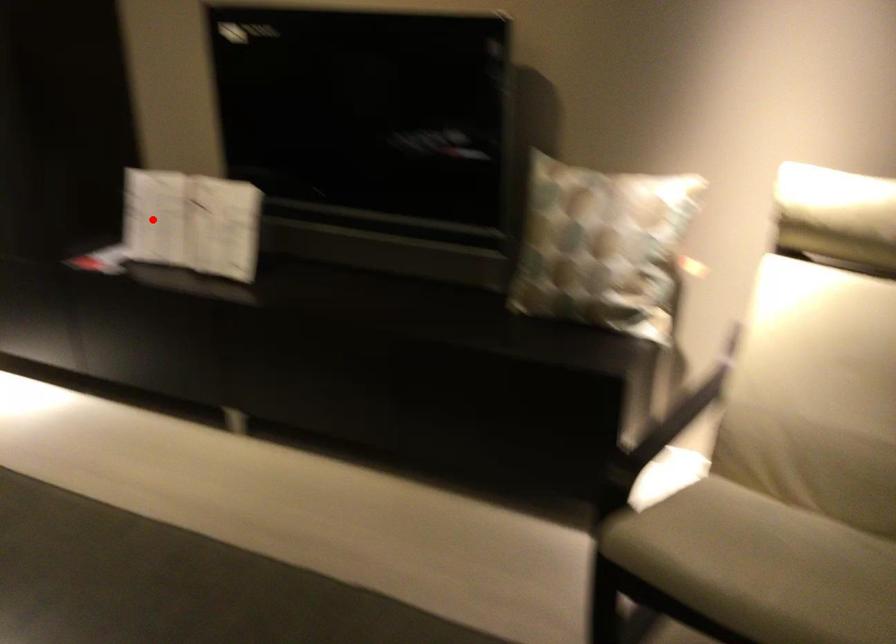
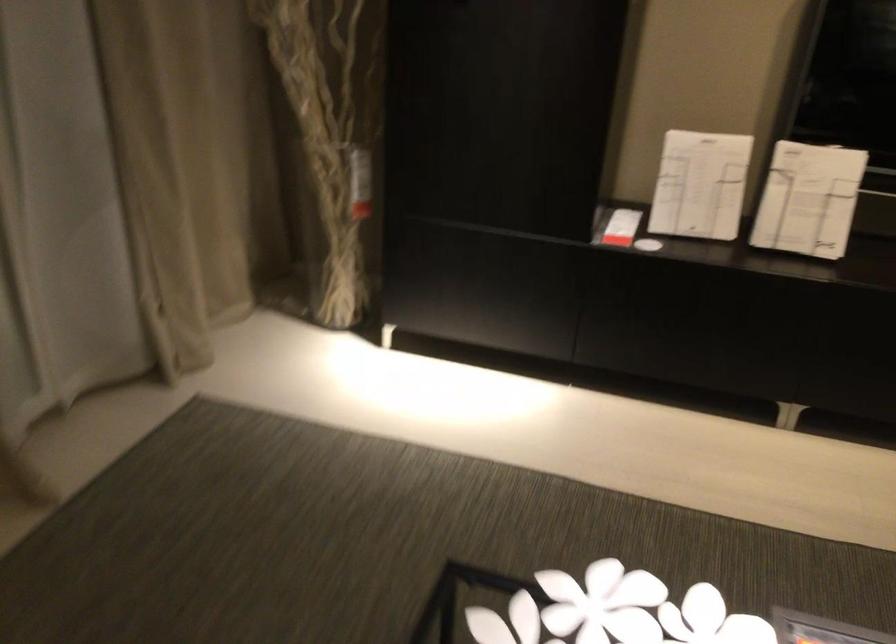
Question: I am providing you with two images of the same scene from different viewpoints. In image1, a red point is highlighted. Considering the same 3D point in image2, which of the following is correct?

Choices:
 (A) It is closer
 (B) It is farther

Answer: (A)